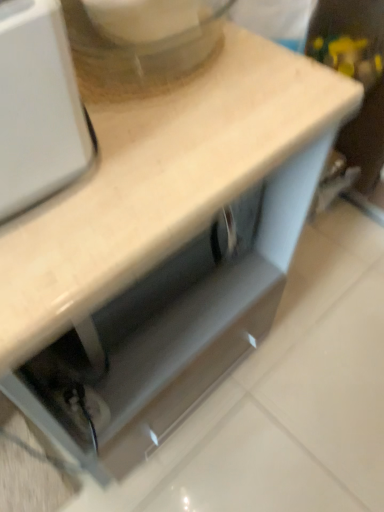
The height and width of the screenshot is (512, 384). What do you see at coordinates (160, 181) in the screenshot?
I see `white matte countertop at upper center` at bounding box center [160, 181].

The image size is (384, 512). I want to click on white matte countertop at upper center, so click(x=160, y=181).

Measure the distance between white plastic mixer at upper left and camera.

They are 19.67 inches apart.

Locate an element on the screen. The height and width of the screenshot is (512, 384). white plastic mixer at upper left is located at coordinates (139, 46).

Describe the element at coordinates (139, 46) in the screenshot. The width and height of the screenshot is (384, 512). I see `white plastic mixer at upper left` at that location.

The height and width of the screenshot is (512, 384). I want to click on white matte countertop at upper center, so click(x=160, y=181).

Between white matte countertop at upper center and white plastic mixer at upper left, which one appears on the left side from the viewer's perspective?

white matte countertop at upper center.

Considering the relative positions of white matte countertop at upper center and white plastic mixer at upper left in the image provided, is white matte countertop at upper center in front of white plastic mixer at upper left?

Yes, it is in front of white plastic mixer at upper left.

Considering the positions of point (92, 227) and point (121, 73), is point (92, 227) closer or farther from the camera than point (121, 73)?

Point (92, 227) is positioned closer to the camera compared to point (121, 73).

From the image's perspective, who appears lower, white matte countertop at upper center or white plastic mixer at upper left?

white matte countertop at upper center.

From a real-world perspective, who is located lower, white matte countertop at upper center or white plastic mixer at upper left?

white matte countertop at upper center.

In terms of width, does white matte countertop at upper center look wider or thinner when compared to white plastic mixer at upper left?

Clearly, white matte countertop at upper center has more width compared to white plastic mixer at upper left.

Can you confirm if white matte countertop at upper center is shorter than white plastic mixer at upper left?

In fact, white matte countertop at upper center may be taller than white plastic mixer at upper left.

Which of these two, white matte countertop at upper center or white plastic mixer at upper left, is smaller?

white plastic mixer at upper left is smaller.

Can we say white matte countertop at upper center lies outside white plastic mixer at upper left?

white matte countertop at upper center lies outside white plastic mixer at upper left's area.

In the scene shown: Is white matte countertop at upper center touching white plastic mixer at upper left?

white matte countertop at upper center is not next to white plastic mixer at upper left, and they're not touching.

Could you tell me if white matte countertop at upper center is turned towards white plastic mixer at upper left?

No, white matte countertop at upper center is not turned towards white plastic mixer at upper left.

Can you tell me how much white matte countertop at upper center and white plastic mixer at upper left differ in facing direction?

They differ by 92 degrees in their facing directions.

You are a GUI agent. You are given a task and a screenshot of the screen. Output one action in this format:
    pyautogui.click(x=<x>, y=<y>)
    Task: Click on the countertop on the left of white plastic mixer at upper left
    
    Given the screenshot: What is the action you would take?
    pyautogui.click(x=160, y=181)

Considering the positions of objects white plastic mixer at upper left and white matte countertop at upper center in the image provided, who is more to the right, white plastic mixer at upper left or white matte countertop at upper center?

From the viewer's perspective, white plastic mixer at upper left appears more on the right side.

Which object is closer to the camera, white plastic mixer at upper left or white matte countertop at upper center?

white matte countertop at upper center is closer to the camera.

Which point is more forward, [194,13] or [221,74]?

The point [194,13] is in front.

From the image's perspective, is white plastic mixer at upper left under white matte countertop at upper center?

No, from the image's perspective, white plastic mixer at upper left is not beneath white matte countertop at upper center.

From a real-world perspective, relative to white matte countertop at upper center, is white plastic mixer at upper left vertically above or below?

From a real-world perspective, white plastic mixer at upper left is physically above white matte countertop at upper center.

Considering the relative sizes of white plastic mixer at upper left and white matte countertop at upper center in the image provided, is white plastic mixer at upper left wider than white matte countertop at upper center?

In fact, white plastic mixer at upper left might be narrower than white matte countertop at upper center.

Can you confirm if white plastic mixer at upper left is taller than white matte countertop at upper center?

In fact, white plastic mixer at upper left may be shorter than white matte countertop at upper center.

Does white plastic mixer at upper left have a smaller size compared to white matte countertop at upper center?

Correct, white plastic mixer at upper left occupies less space than white matte countertop at upper center.

Is white matte countertop at upper center located within white plastic mixer at upper left?

Definitely not — white matte countertop at upper center is not inside white plastic mixer at upper left.

Is white plastic mixer at upper left not close to white matte countertop at upper center?

No.

Could you tell me if white plastic mixer at upper left is facing white matte countertop at upper center?

Result: No.

How many degrees apart are the facing directions of white plastic mixer at upper left and white matte countertop at upper center?

The facing directions of white plastic mixer at upper left and white matte countertop at upper center are 92 degrees apart.

This screenshot has height=512, width=384. I want to click on mixer that is above the white matte countertop at upper center (from a real-world perspective), so click(139, 46).

This screenshot has height=512, width=384. In order to click on mixer located above the white matte countertop at upper center (from the image's perspective) in this screenshot , I will do `click(139, 46)`.

At what (x,y) coordinates should I click in order to perform the action: click on mixer behind the white matte countertop at upper center. Please return your answer as a coordinate pair (x, y). Looking at the image, I should click on (139, 46).